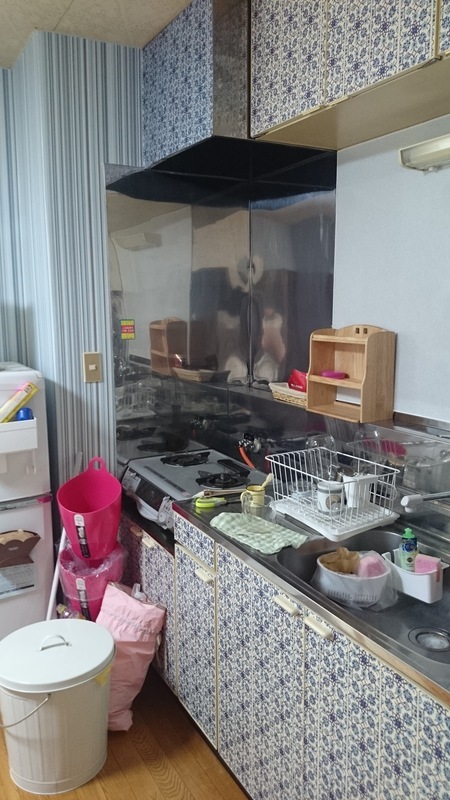
The width and height of the screenshot is (450, 800). Find the location of `wall above sink`. wall above sink is located at coordinates (426, 356).